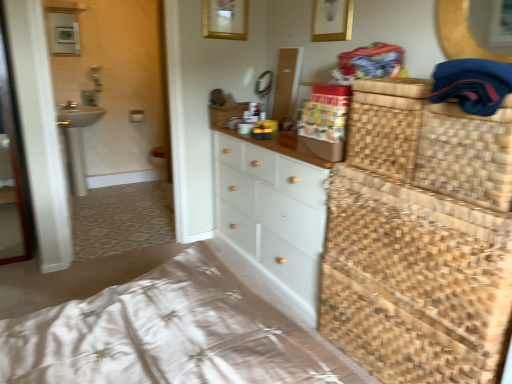
Question: Does transparent glass screen door at left have a greater width compared to woven wood bed frame at lower right?

Choices:
 (A) no
 (B) yes

Answer: (A)

Question: Does transparent glass screen door at left have a greater height compared to woven wood bed frame at lower right?

Choices:
 (A) no
 (B) yes

Answer: (B)

Question: Is transparent glass screen door at left to the left of woven wood bed frame at lower right from the viewer's perspective?

Choices:
 (A) yes
 (B) no

Answer: (A)

Question: Are transparent glass screen door at left and woven wood bed frame at lower right making contact?

Choices:
 (A) no
 (B) yes

Answer: (A)

Question: Can you confirm if transparent glass screen door at left is thinner than woven wood bed frame at lower right?

Choices:
 (A) yes
 (B) no

Answer: (A)

Question: Is white painted wood chest of drawers at center inside the boundaries of dark blue fabric at upper right, or outside?

Choices:
 (A) outside
 (B) inside

Answer: (A)

Question: In the image, is white painted wood chest of drawers at center positioned in front of or behind dark blue fabric at upper right?

Choices:
 (A) front
 (B) behind

Answer: (B)

Question: From their relative heights in the image, would you say white painted wood chest of drawers at center is taller or shorter than dark blue fabric at upper right?

Choices:
 (A) short
 (B) tall

Answer: (B)

Question: Looking at their shapes, would you say white painted wood chest of drawers at center is wider or thinner than dark blue fabric at upper right?

Choices:
 (A) wide
 (B) thin

Answer: (A)

Question: Considering the relative positions of white painted wood chest of drawers at center and woven straw basket at center, the 1th basket viewed from the left, in the image provided, is white painted wood chest of drawers at center to the left or to the right of woven straw basket at center, the 1th basket viewed from the left,?

Choices:
 (A) left
 (B) right

Answer: (B)

Question: Considering their positions, is white painted wood chest of drawers at center located in front of or behind woven straw basket at center, the 1th basket viewed from the left?

Choices:
 (A) behind
 (B) front

Answer: (B)

Question: Considering the positions of white painted wood chest of drawers at center and woven straw basket at center, the 1th basket viewed from the left, in the image, is white painted wood chest of drawers at center bigger or smaller than woven straw basket at center, the 1th basket viewed from the left,?

Choices:
 (A) small
 (B) big

Answer: (B)

Question: From a real-world perspective, is white painted wood chest of drawers at center above or below woven straw basket at center, which is counted as the second basket, starting from the front?

Choices:
 (A) below
 (B) above

Answer: (A)

Question: From the image's perspective, is transparent glass screen door at left above or below dark blue fabric at upper right?

Choices:
 (A) above
 (B) below

Answer: (B)

Question: Is point (11, 218) closer or farther from the camera than point (500, 67)?

Choices:
 (A) farther
 (B) closer

Answer: (A)